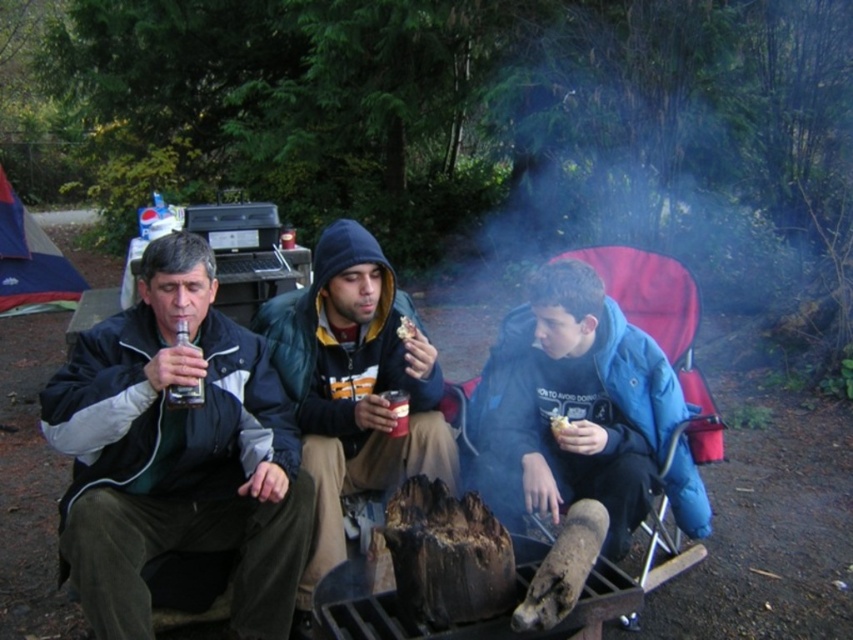
Looking at this image, you are planning to place the translucent glass bottle at center and the smooth brown bread at center on a small shelf. The shelf can only hold items that are no taller than 15 cm. Which item might not fit on the shelf?

The translucent glass bottle at center is much taller than the smooth brown bread at center, so the translucent glass bottle at center might not fit on the shelf if it exceeds the 15 cm height limit.

You are a photographer trying to capture a closeup shot of both the translucent glass bottle at center and the smooth brown bread at center in the scene. Your camera has a maximum focus range of 25 inches. Can you fit both items within the camera frame without moving the camera?

The translucent glass bottle at center and the smooth brown bread at center are 28.29 inches apart, which exceeds the camera maximum focus range of 25 inches. Therefore, you cannot fit both items within the camera frame without moving the camera.